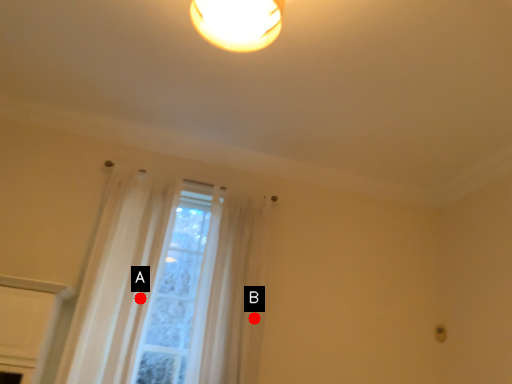
Question: Two points are circled on the image, labeled by A and B beside each circle. Which point is closer to the camera?

Choices:
 (A) A is closer
 (B) B is closer

Answer: (A)